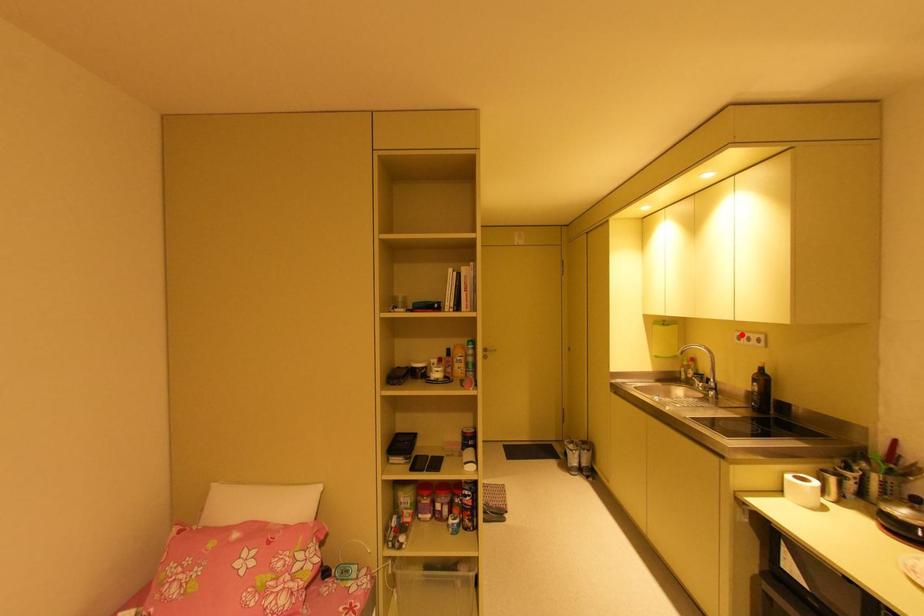
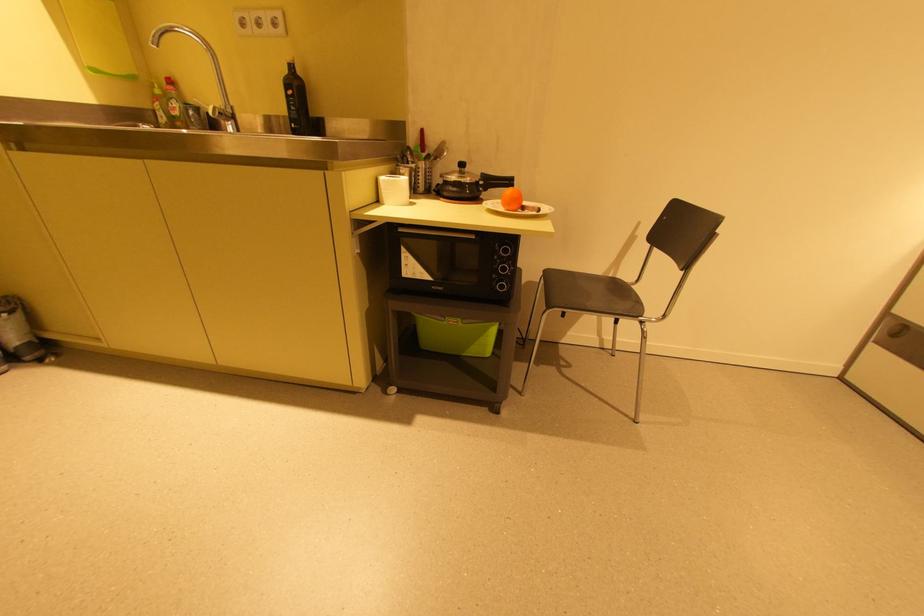
Where in the second image is the point corresponding to the highlighted location from the first image?

(242, 17)